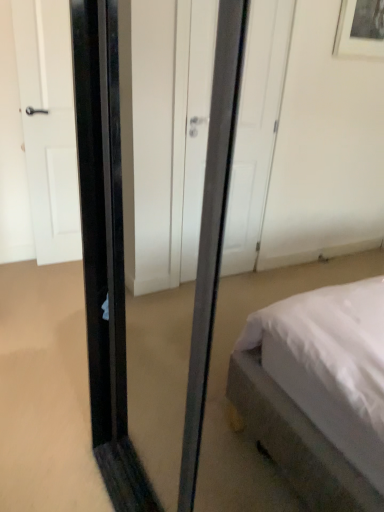
This screenshot has height=512, width=384. I want to click on free region under white matte door at left (from a real-world perspective), so click(x=59, y=259).